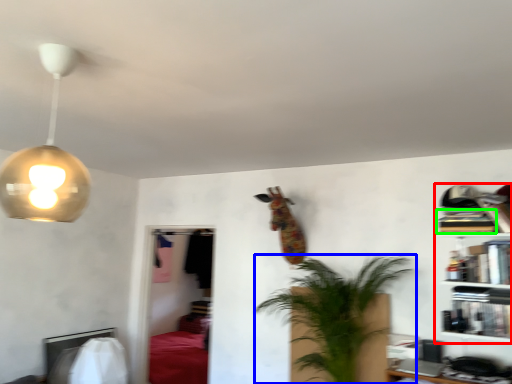
Question: Which object is positioned farthest from shelf (highlighted by a red box)? Select from houseplant (highlighted by a blue box) and book (highlighted by a green box).

Choices:
 (A) houseplant
 (B) book

Answer: (A)